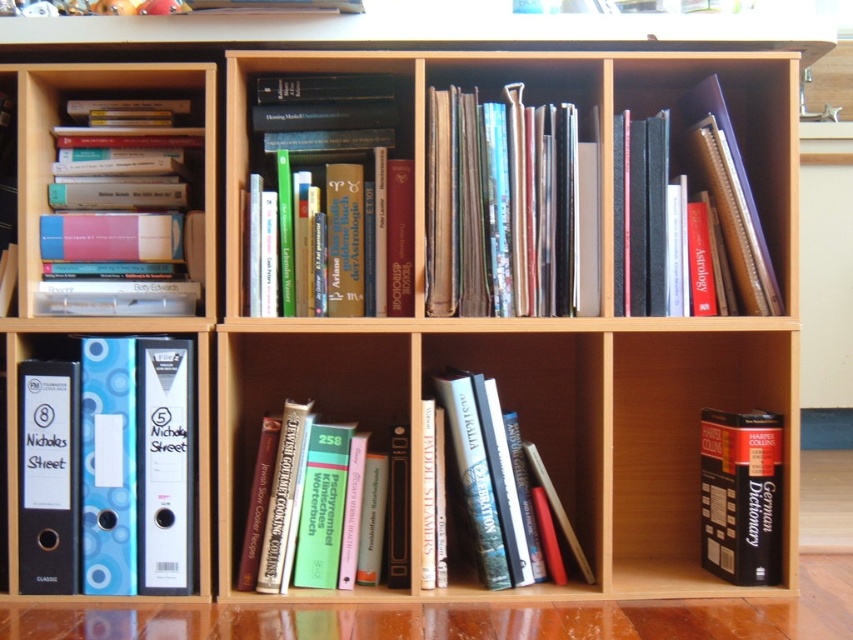
Question: Is shiny metallic books at center positioned behind hardcover book at center?

Choices:
 (A) no
 (B) yes

Answer: (B)

Question: Which point is farther from the camera taking this photo?

Choices:
 (A) (665, 332)
 (B) (469, 211)
 (C) (300, 579)

Answer: (A)

Question: Among these objects, which one is nearest to the camera?

Choices:
 (A) blue glossy folder at left
 (B) shiny metallic books at center
 (C) matte hardcover books at upper left

Answer: (A)

Question: Which point is farther to the camera?

Choices:
 (A) (665, 502)
 (B) (749, 289)

Answer: (A)

Question: Is hardcover books at center to the left of hardcover book at center from the viewer's perspective?

Choices:
 (A) no
 (B) yes

Answer: (B)

Question: Does green paperback book at center lie in front of hardcover book at upper right?

Choices:
 (A) no
 (B) yes

Answer: (B)